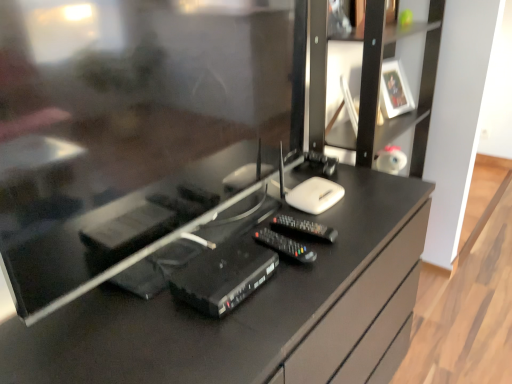
Where is `vacant area that is situated to the right of black plastic remote at center`? Image resolution: width=512 pixels, height=384 pixels. vacant area that is situated to the right of black plastic remote at center is located at coordinates pos(362,221).